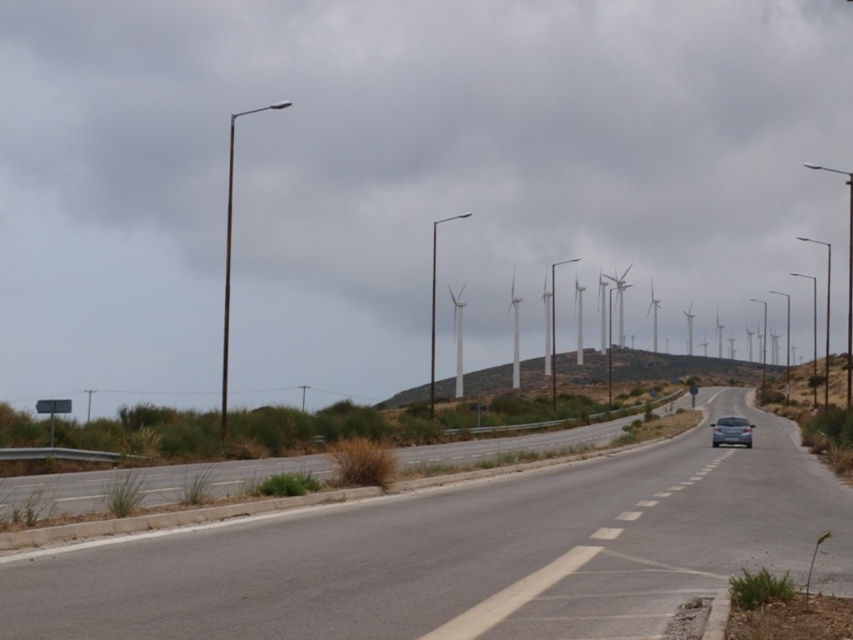
You are a drone operator planning to capture aerial footage of the asphalt road at center. The camera is mounted at a fixed position above the road. To ensure the road remains centered in the frame, where should you position the camera relative to the road?

The asphalt road at center is located at point (465, 554), so the camera should be positioned directly above this coordinate to keep the road centered in the frame.